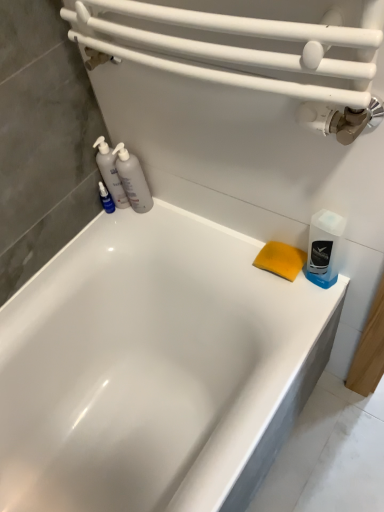
The height and width of the screenshot is (512, 384). Identify the location of vacant space in between translucent plastic bottles at left, the second cleaning product in the right-to-left sequence, and blue translucent bottle at right, which is the first cleaning product in right-to-left order. pyautogui.click(x=203, y=230).